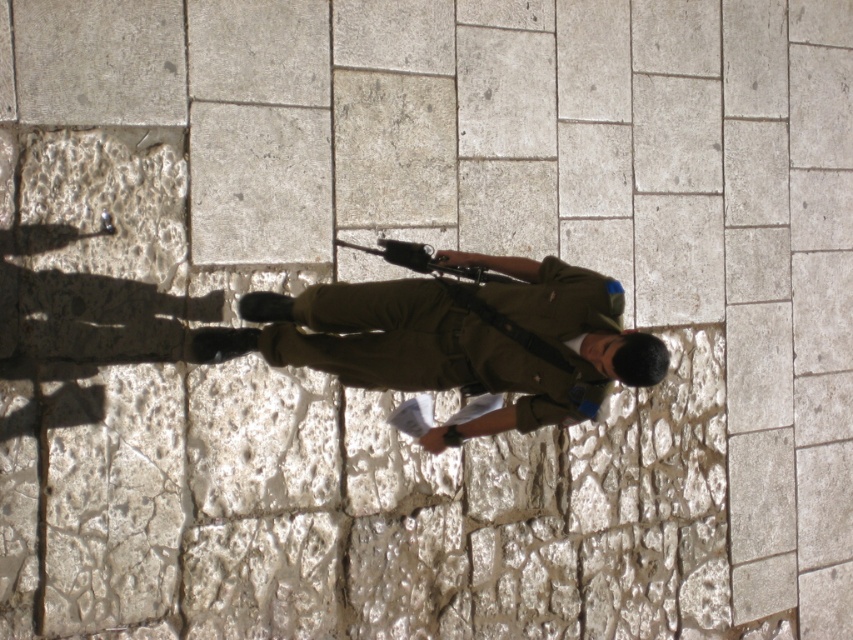
You are a photographer trying to capture the person in the image. You want to ensure that both the olive green uniform at center and the polished metal rifle at center are clearly visible in your shot. Based on their positions, which object should you focus on first to ensure both are in focus?

The olive green uniform at center is located below the polished metal rifle at center. Since the rifle is higher up, focusing on the rifle first would naturally include the uniform below it in the frame, ensuring both are in focus.

You are a photographer trying to capture the person in the scene. Since you want to focus on the olive green uniform at center and the polished metal rifle at center, which object should you adjust your camera focus on first to ensure clarity?

The olive green uniform at center is closer to the viewer than the polished metal rifle at center, so you should focus on the olive green uniform at center first to ensure clarity.

You are a photographer positioned at a certain distance from the olive green uniform at center. You need to capture a clear photo of the uniform while ensuring the textured stone wall in the background remains in focus. Based on the given information, what is the minimum distance you should maintain between yourself and the uniform to achieve this?

The olive green uniform at center is 16.14 feet away from the viewer. To ensure both the uniform and the textured stone wall in the background are in focus, you should maintain at least 16.14 feet distance from the uniform.